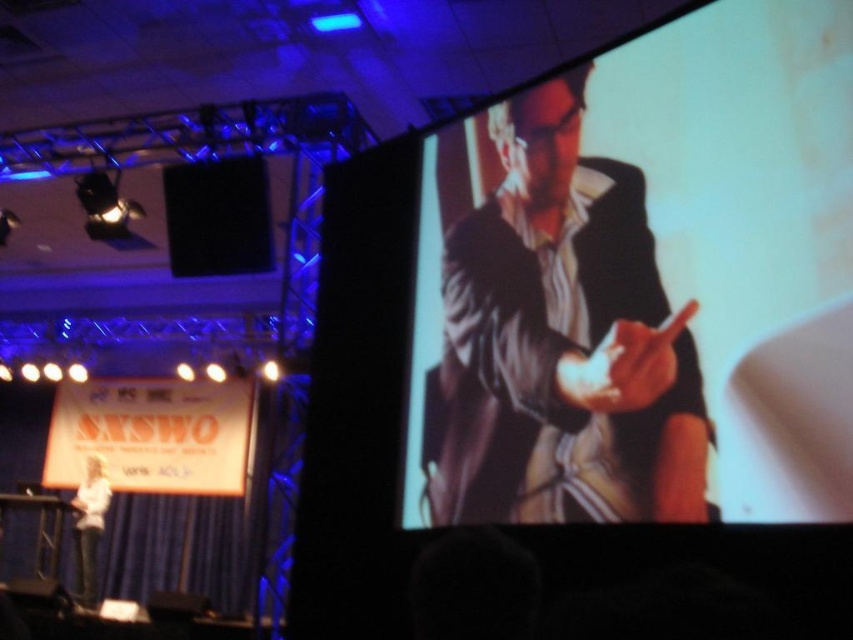
You are attending a conference and need to take a photo of the speaker. The speaker is wearing a matte black suit at center and there is also a black matte speaker at upper left. Which one is to the right of the other?

The matte black suit at center is positioned on the right side of black matte speaker at upper left.

You are an attendee at the SXSW event and want to take a photo of both the matte black suit at center and the black matte speaker at upper left. Which one should you focus on first to ensure both are in the frame?

The matte black suit at center is located below the black matte speaker at upper left, so you should focus on the black matte speaker at upper left first to ensure both are in the frame.

You are organizing a conference and need to place a new banner that is 1.2 meters wide. You have two options for placement near the white paper at lower left and the black matte speaker at upper left. Based on their sizes, which object can accommodate the banner without overlapping?

The white paper at lower left is bigger than the black matte speaker at upper left, so the banner can be placed near the white paper at lower left as it has more space.